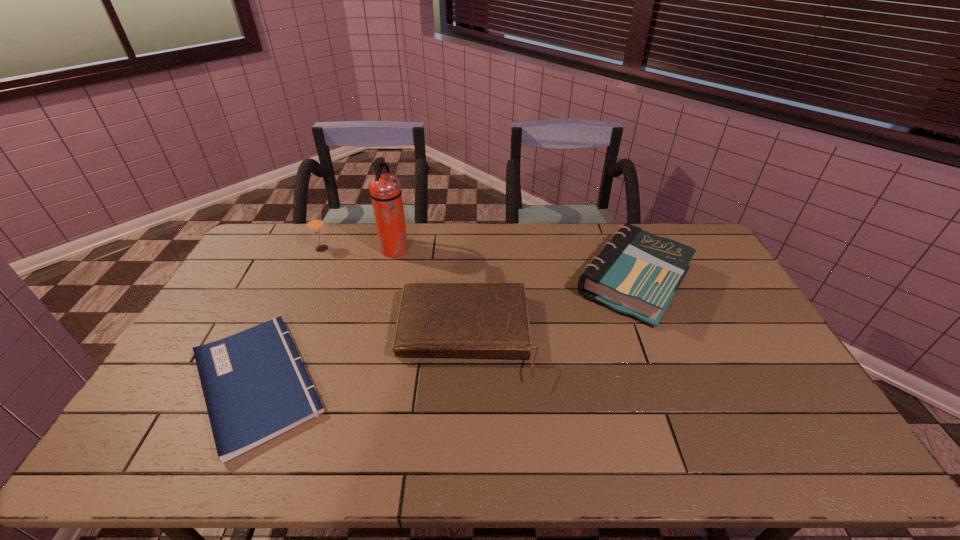
I want to click on object located at the near left corner, so click(255, 386).

Find the location of a particular element. The image size is (960, 540). object located at the far right corner is located at coordinates (637, 273).

At what (x,y) coordinates should I click in order to perform the action: click on vacant space at the far edge. Please return your answer as a coordinate pair (x, y). Image resolution: width=960 pixels, height=540 pixels. Looking at the image, I should click on (604, 224).

Image resolution: width=960 pixels, height=540 pixels. What are the coordinates of `free location at the near edge of the desktop` in the screenshot? It's located at (333, 460).

In the image, there is a desktop. Where is `vacant space at the left edge`? The height and width of the screenshot is (540, 960). vacant space at the left edge is located at coordinates (253, 301).

I want to click on free location at the right edge of the desktop, so click(775, 387).

The width and height of the screenshot is (960, 540). In the image, there is a desktop. Find the location of `blank space at the far left corner`. blank space at the far left corner is located at coordinates (288, 249).

Where is `vacant region at the far right corner of the desktop`? This screenshot has height=540, width=960. vacant region at the far right corner of the desktop is located at coordinates (698, 255).

Locate an element on the screen. The width and height of the screenshot is (960, 540). free spot between the rightmost paperback book and the fire extinguisher is located at coordinates (514, 266).

Identify the location of free space between the rightmost object and the second tallest object. (478, 265).